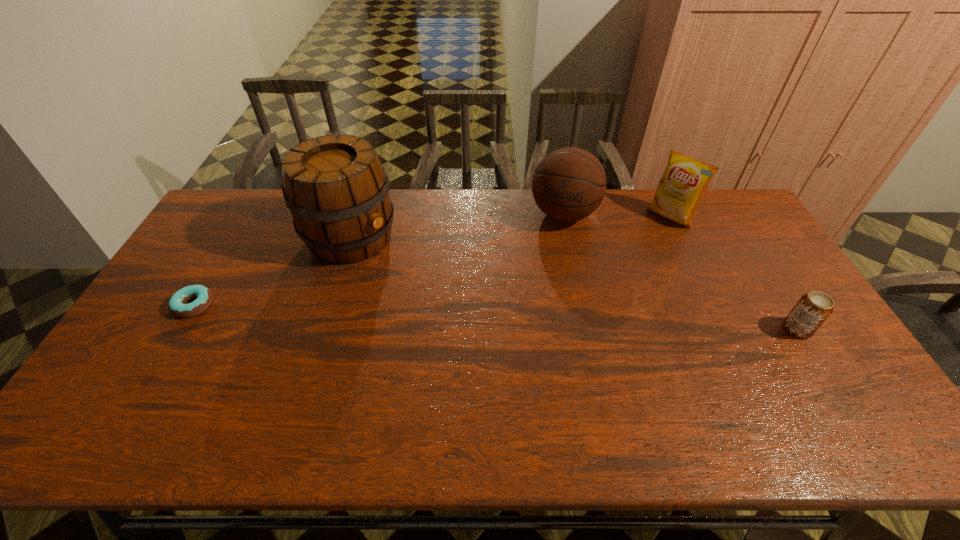
Identify the location of free spot on the desktop that is between the leftmost object and the rightmost object and is positioned on the side of the fourth object from right to left where the spigot is located. (475, 316).

Image resolution: width=960 pixels, height=540 pixels. I want to click on free space on the desktop that is between the shortest object and the rightmost object and is positioned on the side with brand label of the third object from left to right, so click(527, 318).

Identify the location of vacant space on the desktop that is between the leftmost object and the second shortest object and is positioned on the front-facing side of the second object from right to left. (566, 320).